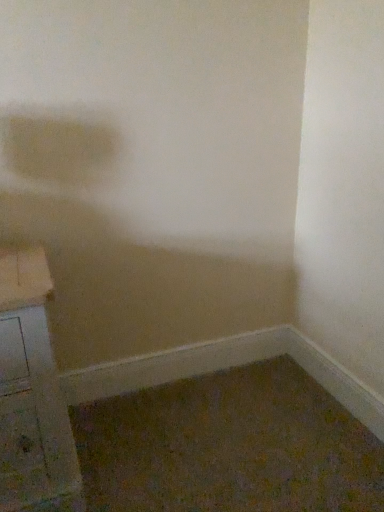
What is the approximate height of wooden file cabinet at lower left?

It is 26.97 inches.

Image resolution: width=384 pixels, height=512 pixels. Describe the element at coordinates (30, 390) in the screenshot. I see `wooden file cabinet at lower left` at that location.

In order to face wooden file cabinet at lower left, should I rotate leftwards or rightwards?

To face it directly, rotate left by 21.190 degrees.

Image resolution: width=384 pixels, height=512 pixels. I want to click on wooden file cabinet at lower left, so click(30, 390).

Where is `wooden file cabinet at lower left`? The width and height of the screenshot is (384, 512). wooden file cabinet at lower left is located at coordinates (30, 390).